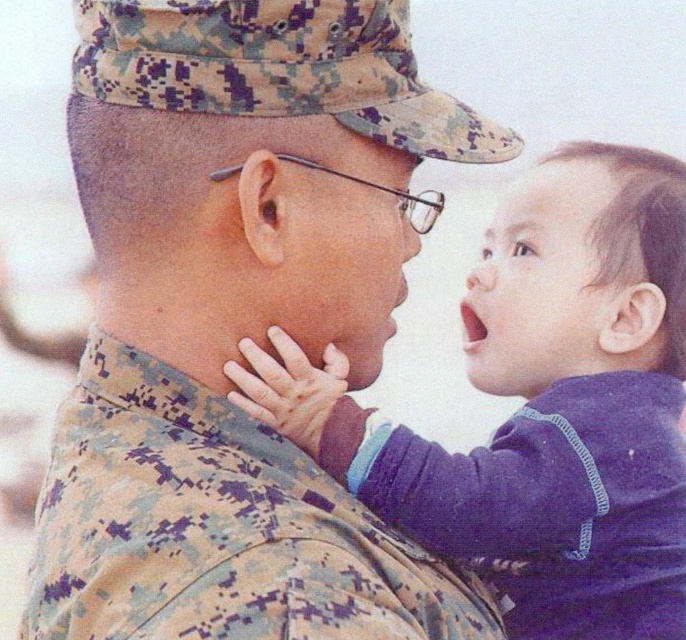
Who is positioned more to the right, camouflage uniform at center or purple fleece jacket at center?

purple fleece jacket at center

Who is taller, camouflage uniform at center or purple fleece jacket at center?

camouflage uniform at center

Is point (343, 339) behind point (543, 524)?

No, it is not.

The image size is (686, 640). Identify the location of camouflage uniform at center. 237,320.

Is point (163, 548) in front of point (626, 477)?

Yes, it is.

This screenshot has width=686, height=640. In order to click on camouflage uniform at center in this screenshot , I will do `click(237, 320)`.

Does purple fleece jacket at center have a smaller size compared to camouflage fabric at center?

Actually, purple fleece jacket at center might be larger than camouflage fabric at center.

Measure the distance between point (x=270, y=419) and camera.

They are 1.74 meters apart.

What do you see at coordinates (541, 404) in the screenshot? The height and width of the screenshot is (640, 686). I see `purple fleece jacket at center` at bounding box center [541, 404].

Find the location of `purple fleece jacket at center`. purple fleece jacket at center is located at coordinates (541, 404).